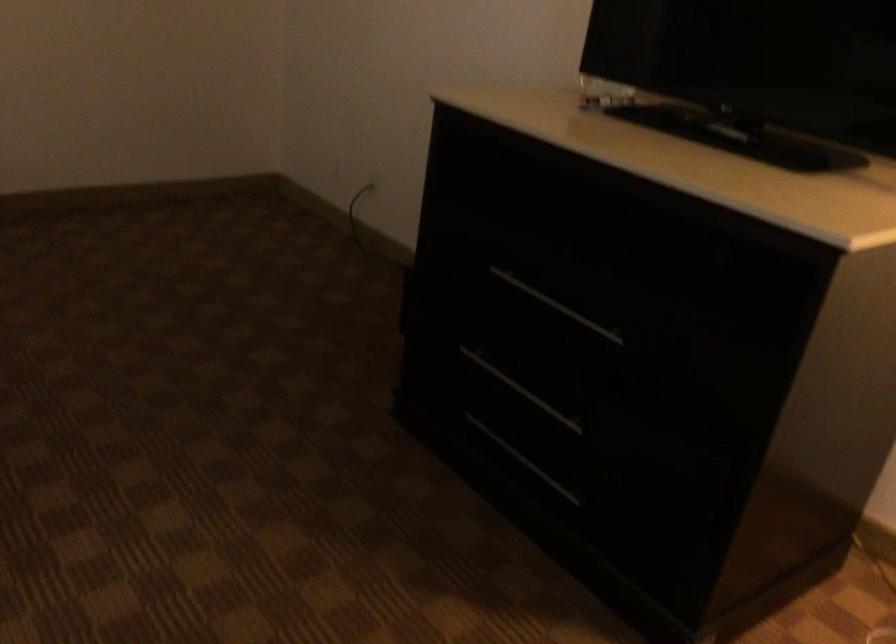
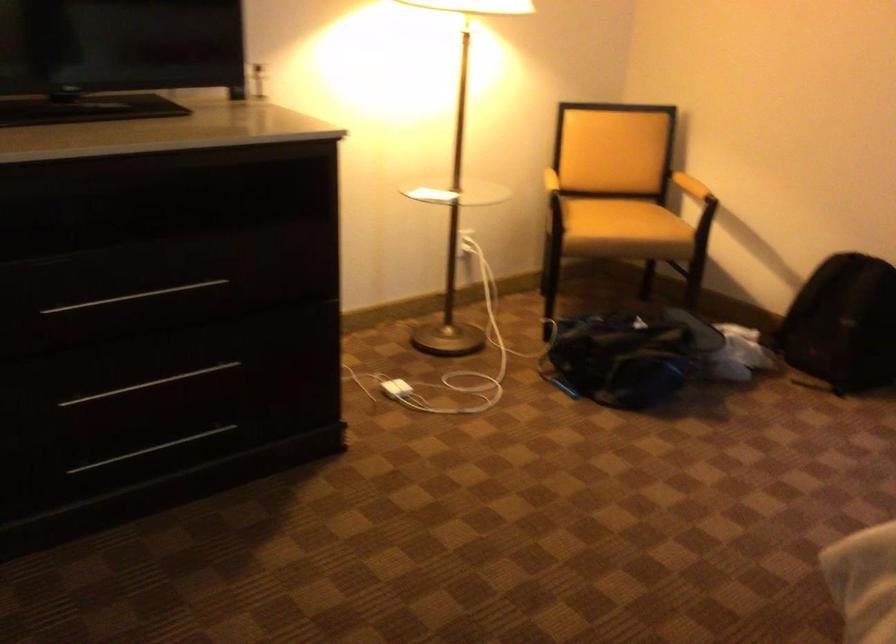
Locate, in the second image, the point that corresponds to the point at 569,308 in the first image.

(134, 297)